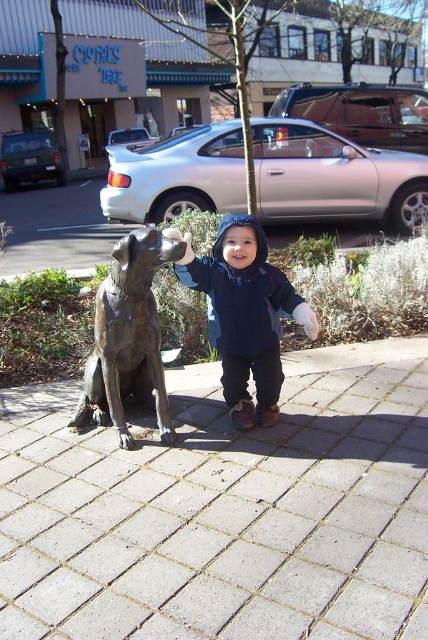
Question: Which object is farther from the camera taking this photo?

Choices:
 (A) paved stone pavement at center
 (B) bronze statue at left
 (C) matte blue jacket at center

Answer: (B)

Question: Among these points, which one is farthest from the camera?

Choices:
 (A) pos(345,586)
 (B) pos(125,438)
 (C) pos(261,420)

Answer: (C)

Question: Estimate the real-world distances between objects in this image. Which object is closer to the matte blue jacket at center?

Choices:
 (A) paved stone pavement at center
 (B) bronze statue at left

Answer: (B)

Question: Is matte blue jacket at center wider than bronze statue at left?

Choices:
 (A) no
 (B) yes

Answer: (B)

Question: Where is paved stone pavement at center located in relation to matte blue jacket at center in the image?

Choices:
 (A) below
 (B) above

Answer: (A)

Question: Does paved stone pavement at center have a smaller size compared to matte blue jacket at center?

Choices:
 (A) no
 (B) yes

Answer: (A)